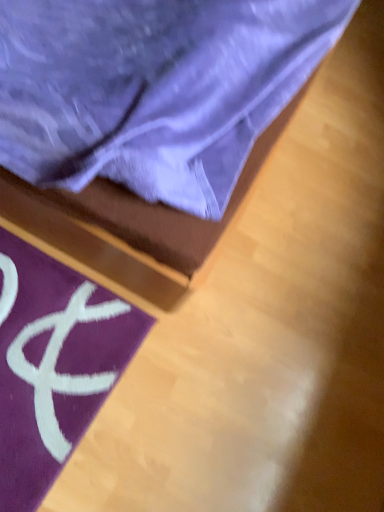
Measure the distance between point (129, 198) and camera.

A distance of 33.07 inches exists between point (129, 198) and camera.

This screenshot has width=384, height=512. Describe the element at coordinates (155, 106) in the screenshot. I see `wooden bed frame at upper left` at that location.

Locate an element on the screen. wooden bed frame at upper left is located at coordinates (155, 106).

The width and height of the screenshot is (384, 512). I want to click on wooden bed frame at upper left, so click(x=155, y=106).